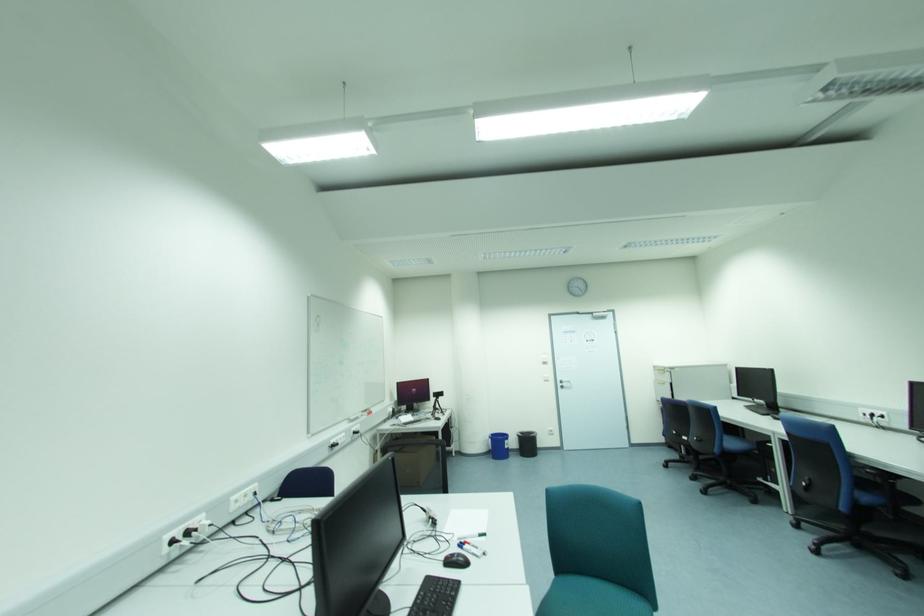
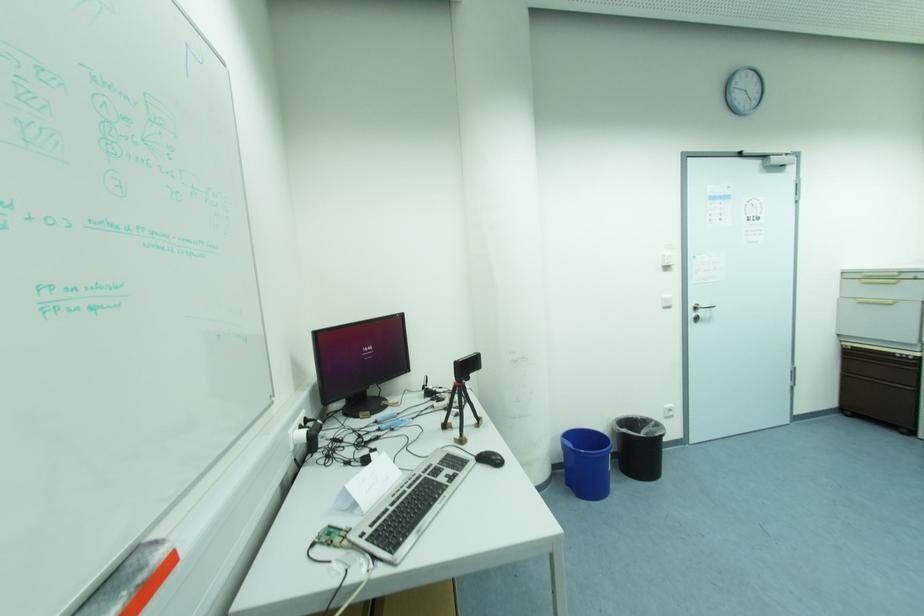
Find the pixel in the second image that matches (x=562, y=382) in the first image.

(697, 309)